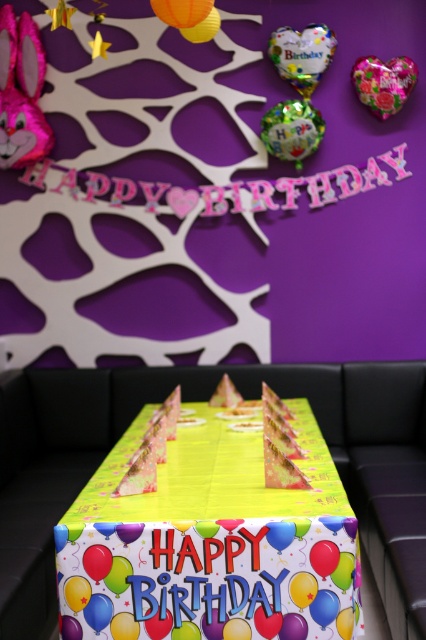
Question: Which of the following is the closest to the observer?

Choices:
 (A) yellow paper cake at center
 (B) pink metallic heart at upper center
 (C) yellow paper table at center

Answer: (C)

Question: Can you confirm if yellow paper table at center is wider than pink metallic heart at upper center?

Choices:
 (A) yes
 (B) no

Answer: (A)

Question: Is yellow paper table at center positioned behind pink metallic heart at upper center?

Choices:
 (A) yes
 (B) no

Answer: (B)

Question: Which is nearer to the yellow paper cake at center?

Choices:
 (A) pink metallic heart at upper center
 (B) yellow paper table at center

Answer: (B)

Question: Which object is closer to the camera taking this photo?

Choices:
 (A) pink metallic heart at upper center
 (B) yellow paper cake at center

Answer: (B)

Question: In this image, where is yellow paper table at center located relative to yellow paper cake at center?

Choices:
 (A) right
 (B) left

Answer: (B)